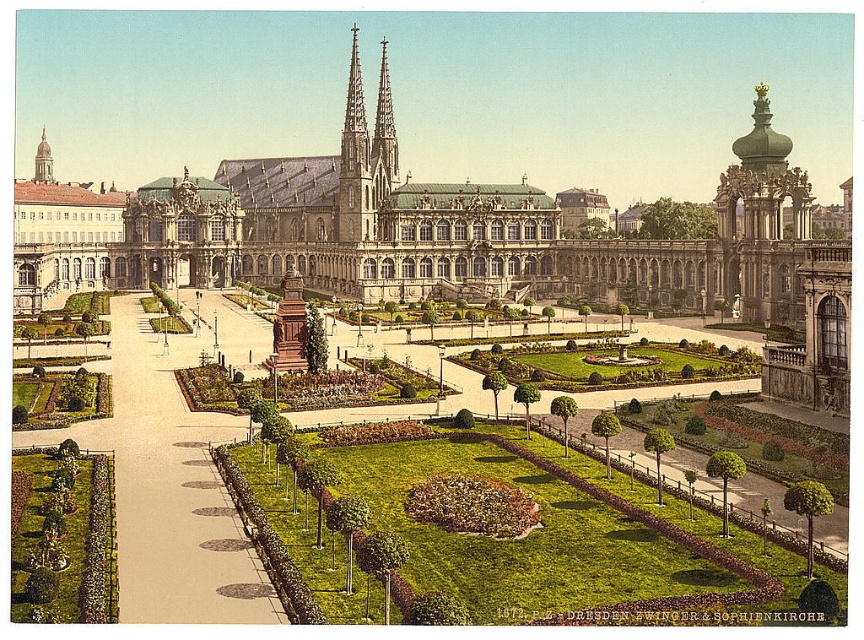
Question: Is stone palace at center behind smooth stone spire at center?

Choices:
 (A) yes
 (B) no

Answer: (B)

Question: Among these objects, which one is farthest from the camera?

Choices:
 (A) stone palace at center
 (B) smooth stone spire at center

Answer: (B)

Question: Does stone palace at center have a smaller size compared to smooth stone spire at center?

Choices:
 (A) yes
 (B) no

Answer: (B)

Question: Which of the following is the closest to the observer?

Choices:
 (A) smooth stone spire at center
 (B) stone palace at center

Answer: (B)

Question: Does stone palace at center have a greater width compared to smooth stone spire at center?

Choices:
 (A) yes
 (B) no

Answer: (A)